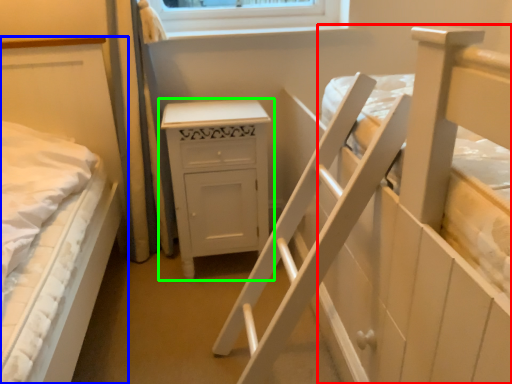
Question: Based on their relative distances, which object is nearer to bed (highlighted by a red box)? Choose from bed (highlighted by a blue box) and chest of drawers (highlighted by a green box).

Choices:
 (A) bed
 (B) chest of drawers

Answer: (B)